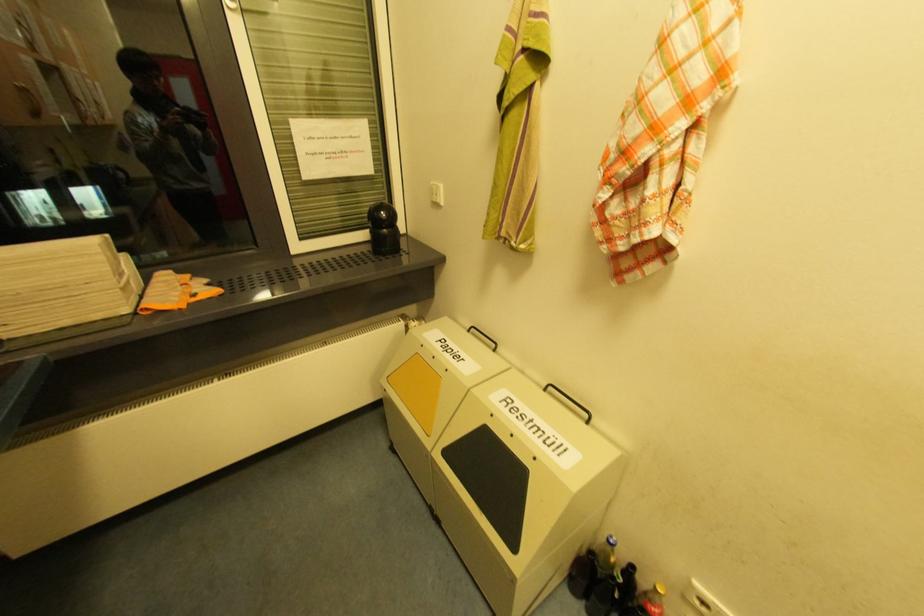
Where is `white light switch`? white light switch is located at coordinates (436, 193).